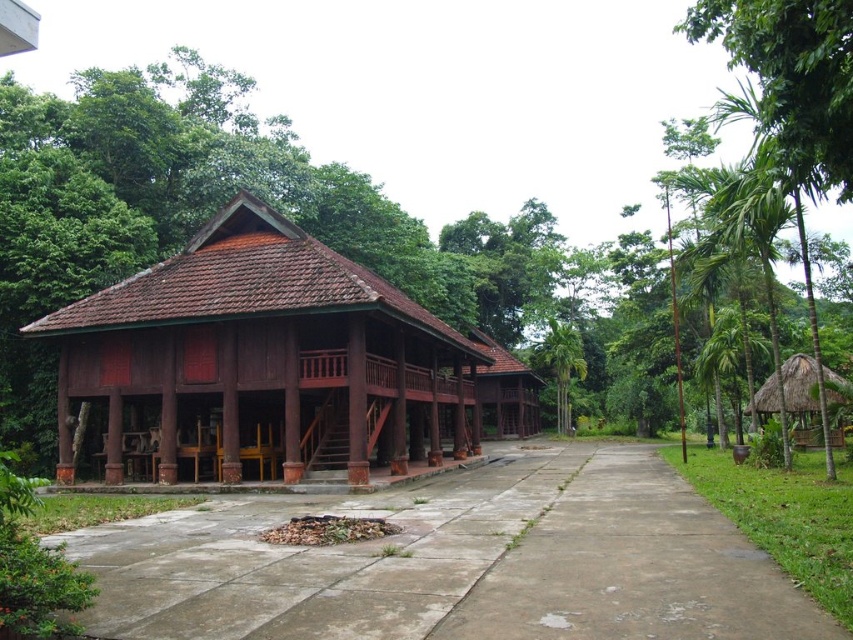
Question: Which object appears closest to the camera in this image?

Choices:
 (A) matte wood hut at center
 (B) green leafy palm tree at center-right
 (C) thatched straw hut at right

Answer: (A)

Question: Which object appears farthest from the camera in this image?

Choices:
 (A) concrete at center
 (B) matte wood hut at center

Answer: (B)

Question: Does thatched straw hut at right appear on the right side of green leafy palm tree at center-right?

Choices:
 (A) no
 (B) yes

Answer: (B)

Question: Which point appears closest to the camera in this image?

Choices:
 (A) (395, 328)
 (B) (549, 323)

Answer: (A)

Question: Is matte wood hut at center above thatched straw hut at right?

Choices:
 (A) yes
 (B) no

Answer: (A)

Question: Is concrete at center in front of matte wood hut at center?

Choices:
 (A) no
 (B) yes

Answer: (B)